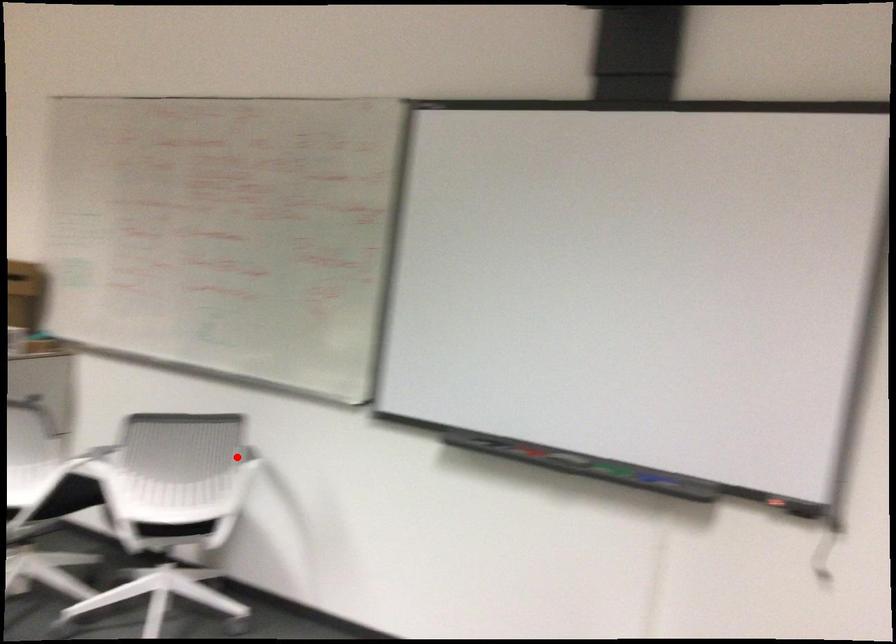
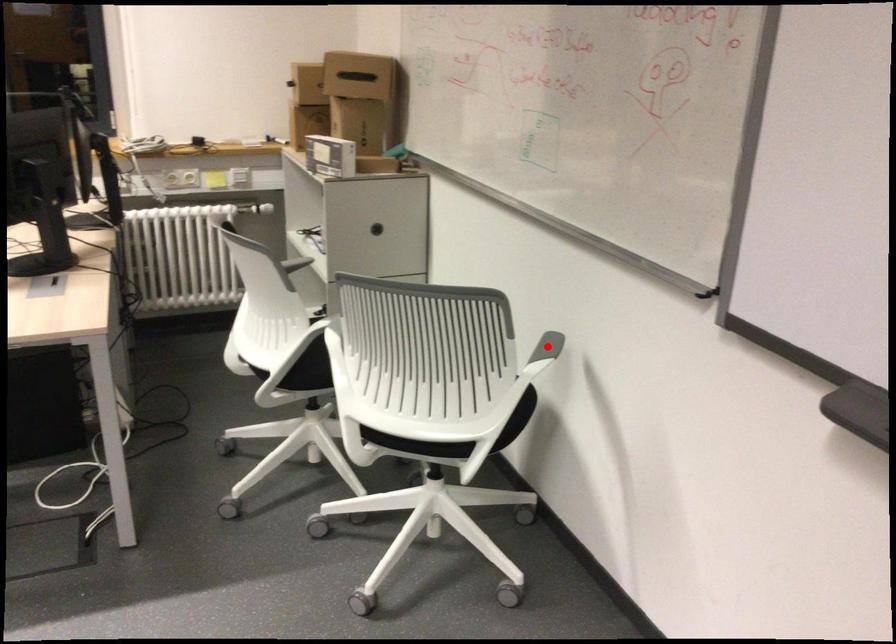
I am providing you with two images of the same scene from different viewpoints. A red point is marked on the first image and another point is marked on the second image. Do the highlighted points in image1 and image2 indicate the same real-world spot?

Yes